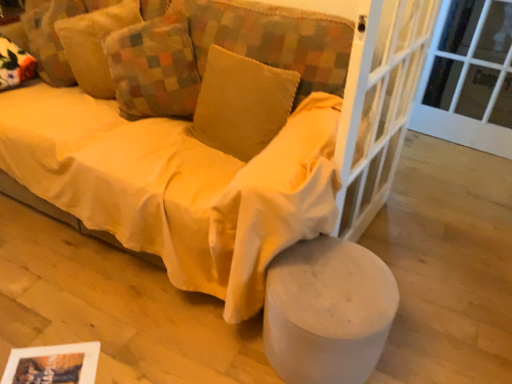
Question: Is matte yellow fabric couch at center positioned before white glass screen door at center right?

Choices:
 (A) no
 (B) yes

Answer: (A)

Question: Does matte yellow fabric couch at center have a lesser height compared to white glass screen door at center right?

Choices:
 (A) no
 (B) yes

Answer: (B)

Question: Is matte yellow fabric couch at center placed right next to white glass screen door at center right?

Choices:
 (A) yes
 (B) no

Answer: (B)

Question: Is matte yellow fabric couch at center facing away from white glass screen door at center right?

Choices:
 (A) yes
 (B) no

Answer: (B)

Question: Does matte yellow fabric couch at center contain white glass screen door at center right?

Choices:
 (A) yes
 (B) no

Answer: (B)

Question: Considering the positions of soft yellow cushion at upper left, the third pillow when ordered from right to left, and white glass screen door at center right in the image, is soft yellow cushion at upper left, the third pillow when ordered from right to left, bigger or smaller than white glass screen door at center right?

Choices:
 (A) big
 (B) small

Answer: (B)

Question: Based on their positions, is soft yellow cushion at upper left, the third pillow when ordered from right to left, located to the left or right of white glass screen door at center right?

Choices:
 (A) right
 (B) left

Answer: (B)

Question: From a real-world perspective, relative to white glass screen door at center right, is soft yellow cushion at upper left, the first pillow in the left-to-right sequence, vertically above or below?

Choices:
 (A) below
 (B) above

Answer: (B)

Question: In terms of height, does soft yellow cushion at upper left, the first pillow in the left-to-right sequence, look taller or shorter compared to white glass screen door at center right?

Choices:
 (A) tall
 (B) short

Answer: (B)

Question: Visually, is soft yellow cushion at upper left, the third pillow when ordered from right to left, positioned to the left or to the right of white fabric stool at lower right?

Choices:
 (A) left
 (B) right

Answer: (A)

Question: Looking at their shapes, would you say soft yellow cushion at upper left, the first pillow in the left-to-right sequence, is wider or thinner than white fabric stool at lower right?

Choices:
 (A) wide
 (B) thin

Answer: (B)

Question: Which is correct: soft yellow cushion at upper left, the third pillow when ordered from right to left, is inside white fabric stool at lower right, or outside of it?

Choices:
 (A) inside
 (B) outside

Answer: (B)

Question: From a real-world perspective, is soft yellow cushion at upper left, the first pillow in the left-to-right sequence, positioned above or below white fabric stool at lower right?

Choices:
 (A) above
 (B) below

Answer: (A)

Question: In terms of size, does white glass door at upper right appear bigger or smaller than white glass screen door at center right?

Choices:
 (A) big
 (B) small

Answer: (B)

Question: In the image, is white glass door at upper right on the left side or the right side of white glass screen door at center right?

Choices:
 (A) right
 (B) left

Answer: (A)